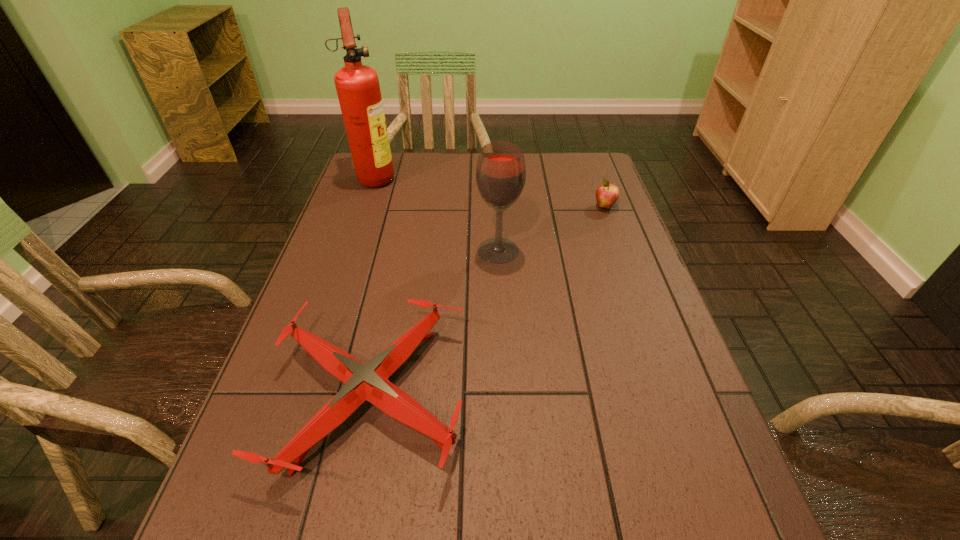
At what (x,y) coordinates should I click in order to perform the action: click on vacant space at the right edge of the desktop. Please return your answer as a coordinate pair (x, y). Looking at the image, I should click on (588, 235).

Where is `free space between the nearest object and the farthest object`? This screenshot has height=540, width=960. free space between the nearest object and the farthest object is located at coordinates (373, 286).

What are the coordinates of `free area in between the rightmost object and the drone` in the screenshot? It's located at (488, 301).

Identify the location of free spot between the drone and the third nearest object. (488, 301).

You are a GUI agent. You are given a task and a screenshot of the screen. Output one action in this format:
    pyautogui.click(x=<x>, y=<y>)
    Task: Click on the vacant space in between the apple and the third shortest object
    The width and height of the screenshot is (960, 540).
    Given the screenshot: What is the action you would take?
    pyautogui.click(x=551, y=228)

Identify the location of empty space that is in between the farthest object and the shortest object. The width and height of the screenshot is (960, 540). (373, 286).

Locate an element on the screen. free area in between the rightmost object and the nearest object is located at coordinates (488, 301).

Image resolution: width=960 pixels, height=540 pixels. I want to click on vacant point located between the nearest object and the fire extinguisher, so click(x=373, y=286).

Where is `the third closest object to the third shortest object`? The image size is (960, 540). the third closest object to the third shortest object is located at coordinates (358, 89).

Choose which object is the third nearest neighbor to the rightmost object. Please provide its 2D coordinates. Your answer should be formatted as a tuple, i.e. [(x, y)], where the tuple contains the x and y coordinates of a point satisfying the conditions above.

[(358, 89)]